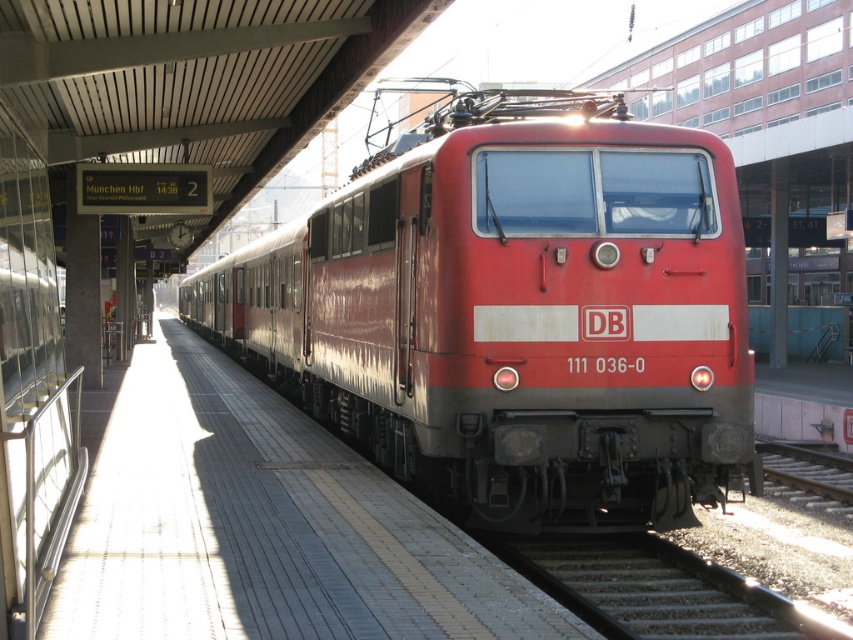
At what (x,y) coordinates should I click in order to perform the action: click on matte red train at center. Please return your answer as a coordinate pair (x, y). The width and height of the screenshot is (853, 640). Looking at the image, I should click on (515, 310).

Can you confirm if matte red train at center is smaller than brick platform at center?

Actually, matte red train at center might be larger than brick platform at center.

What do you see at coordinates (515, 310) in the screenshot? Image resolution: width=853 pixels, height=640 pixels. I see `matte red train at center` at bounding box center [515, 310].

Identify the location of matte red train at center. This screenshot has width=853, height=640. (515, 310).

Does matte red train at center have a greater height compared to gray gravel train track at lower center?

Indeed, matte red train at center has a greater height compared to gray gravel train track at lower center.

Between matte red train at center and gray gravel train track at lower center, which one has less height?

With less height is gray gravel train track at lower center.

Who is more forward, (332,378) or (607,545)?

Positioned in front is point (607,545).

The image size is (853, 640). Find the location of `matte red train at center`. matte red train at center is located at coordinates (515, 310).

Can you confirm if brick platform at center is positioned to the left of gray gravel train track at lower center?

Yes, brick platform at center is to the left of gray gravel train track at lower center.

Can you confirm if brick platform at center is smaller than gray gravel train track at lower center?

Actually, brick platform at center might be larger than gray gravel train track at lower center.

The height and width of the screenshot is (640, 853). What do you see at coordinates (264, 525) in the screenshot?
I see `brick platform at center` at bounding box center [264, 525].

The width and height of the screenshot is (853, 640). Find the location of `brick platform at center`. brick platform at center is located at coordinates (264, 525).